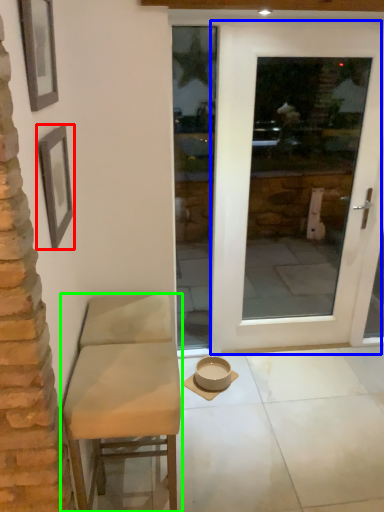
Question: Based on their relative distances, which object is farther from picture frame (highlighted by a red box)? Choose from door (highlighted by a blue box) and chair (highlighted by a green box).

Choices:
 (A) door
 (B) chair

Answer: (A)